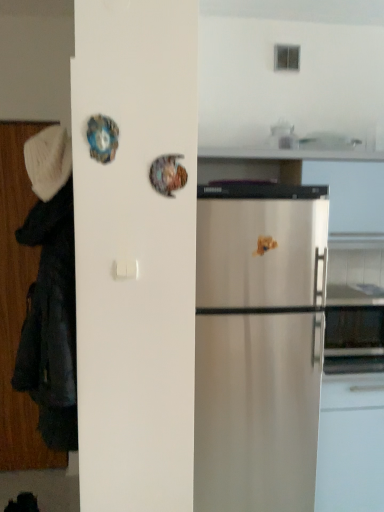
The height and width of the screenshot is (512, 384). What are the coordinates of `black fabric coat at left` in the screenshot? It's located at (50, 292).

The height and width of the screenshot is (512, 384). What do you see at coordinates (50, 292) in the screenshot?
I see `black fabric coat at left` at bounding box center [50, 292].

In order to face black fabric coat at left, should I rotate leftwards or rightwards?

You should rotate left by 19.082 degrees.

Locate an element on the screen. white knitted hat at left is located at coordinates (48, 161).

The image size is (384, 512). Describe the element at coordinates (48, 161) in the screenshot. I see `white knitted hat at left` at that location.

Measure the distance between white knitted hat at left and camera.

A distance of 1.49 meters exists between white knitted hat at left and camera.

Measure the distance between point [27,170] and camera.

A distance of 1.56 meters exists between point [27,170] and camera.

Locate an element on the screen. black fabric coat at left is located at coordinates (50, 292).

Does black fabric coat at left appear on the left side of white knitted hat at left?

Correct, you'll find black fabric coat at left to the left of white knitted hat at left.

Does black fabric coat at left come in front of white knitted hat at left?

Yes.

Does point (48, 193) lie in front of point (47, 175)?

Yes, it is in front of point (47, 175).

From the image's perspective, which one is positioned higher, black fabric coat at left or white knitted hat at left?

white knitted hat at left appears higher in the image.

From a real-world perspective, is black fabric coat at left above or below white knitted hat at left?

black fabric coat at left is below white knitted hat at left.

Considering the sizes of objects black fabric coat at left and white knitted hat at left in the image provided, who is thinner, black fabric coat at left or white knitted hat at left?

white knitted hat at left.

Which of these two, black fabric coat at left or white knitted hat at left, stands taller?

black fabric coat at left.

Between black fabric coat at left and white knitted hat at left, which one has smaller size?

With smaller size is white knitted hat at left.

Can white knitted hat at left be found inside black fabric coat at left?

Absolutely, white knitted hat at left is inside black fabric coat at left.

Is black fabric coat at left with white knitted hat at left?

No, black fabric coat at left is not next to white knitted hat at left.

Is black fabric coat at left facing away from white knitted hat at left?

No.

Where is `couple below the white knitted hat at left (from a real-world perspective)`? This screenshot has width=384, height=512. couple below the white knitted hat at left (from a real-world perspective) is located at coordinates [x=50, y=292].

Is white knitted hat at left at the left side of black fabric coat at left?

No.

Which object is further away from the camera taking this photo, white knitted hat at left or black fabric coat at left?

white knitted hat at left.

Is point (63, 169) farther from camera compared to point (43, 271)?

Yes, point (63, 169) is behind point (43, 271).

From the image's perspective, is white knitted hat at left beneath black fabric coat at left?

No.

From a real-world perspective, who is located lower, white knitted hat at left or black fabric coat at left?

black fabric coat at left.

In terms of width, does white knitted hat at left look wider or thinner when compared to black fabric coat at left?

Considering their sizes, white knitted hat at left looks slimmer than black fabric coat at left.

Between white knitted hat at left and black fabric coat at left, which one has more height?

Standing taller between the two is black fabric coat at left.

Which of these two, white knitted hat at left or black fabric coat at left, is smaller?

Smaller between the two is white knitted hat at left.

Would you say white knitted hat at left contains black fabric coat at left?

Definitely not — black fabric coat at left is not inside white knitted hat at left.

In the scene shown: Would you say white knitted hat at left is a long distance from black fabric coat at left?

No, white knitted hat at left is not far from black fabric coat at left.

Could you tell me if white knitted hat at left is turned towards black fabric coat at left?

No, white knitted hat at left is not aimed at black fabric coat at left.

What's the angular difference between white knitted hat at left and black fabric coat at left's facing directions?

They differ by 6.14e-05 degrees in their facing directions.

At what (x,y) coordinates should I click in order to perform the action: click on hat that appears above the black fabric coat at left (from a real-world perspective). Please return your answer as a coordinate pair (x, y). Looking at the image, I should click on (48, 161).

The width and height of the screenshot is (384, 512). I want to click on couple in front of the white knitted hat at left, so click(50, 292).

Locate an element on the screen. This screenshot has width=384, height=512. couple that appears below the white knitted hat at left (from the image's perspective) is located at coordinates (50, 292).